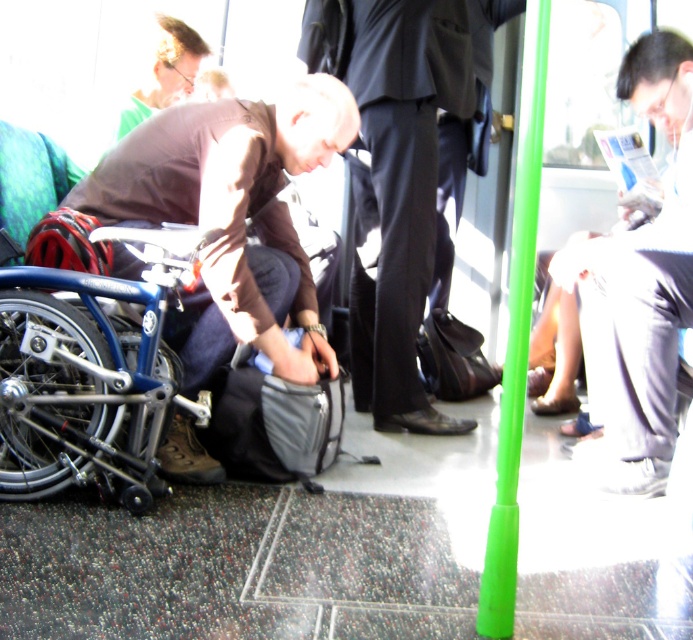
Question: Does matte brown jacket at center have a lesser width compared to matte brown shirt at upper left?

Choices:
 (A) no
 (B) yes

Answer: (A)

Question: Does dark gray suit at center have a larger size compared to white paper at right?

Choices:
 (A) no
 (B) yes

Answer: (B)

Question: Which object appears closest to the camera in this image?

Choices:
 (A) matte brown shirt at upper left
 (B) green plastic pole at center
 (C) dark gray suit at center
 (D) matte brown jacket at center

Answer: (B)

Question: Which object appears farthest from the camera in this image?

Choices:
 (A) white paper at right
 (B) matte brown jacket at center

Answer: (A)

Question: Does dark gray suit at center have a larger size compared to matte brown shirt at upper left?

Choices:
 (A) yes
 (B) no

Answer: (A)

Question: Considering the real-world distances, which object is farthest from the green plastic pole at center?

Choices:
 (A) matte brown shirt at upper left
 (B) dark gray suit at center
 (C) white paper at right

Answer: (A)